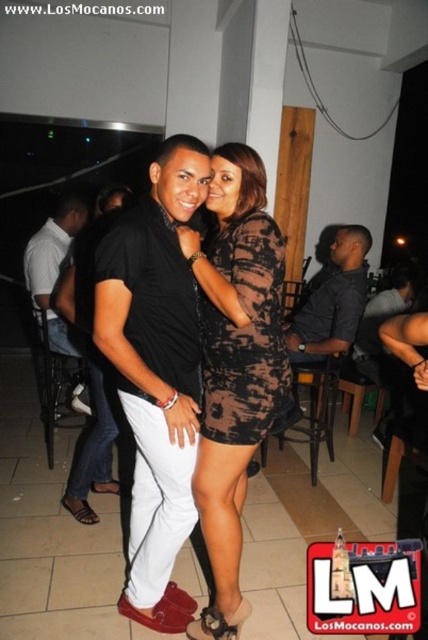
Question: Can you confirm if dark gray textured shirt at center is positioned to the right of black matte shirt at center?

Choices:
 (A) no
 (B) yes

Answer: (B)

Question: Which point appears farthest from the camera in this image?

Choices:
 (A) (51, 232)
 (B) (282, 404)

Answer: (A)

Question: Is printed fabric dress at center to the left of dark gray textured shirt at center from the viewer's perspective?

Choices:
 (A) yes
 (B) no

Answer: (A)

Question: Does black textured dress at center have a greater width compared to dark gray textured shirt at center?

Choices:
 (A) yes
 (B) no

Answer: (B)

Question: Which of these objects is positioned farthest from the black textured dress at center?

Choices:
 (A) black matte shirt at center
 (B) printed fabric dress at center

Answer: (A)

Question: Which object is positioned farthest from the matte black shirt at center?

Choices:
 (A) black matte shirt at center
 (B) dark gray textured shirt at center

Answer: (B)